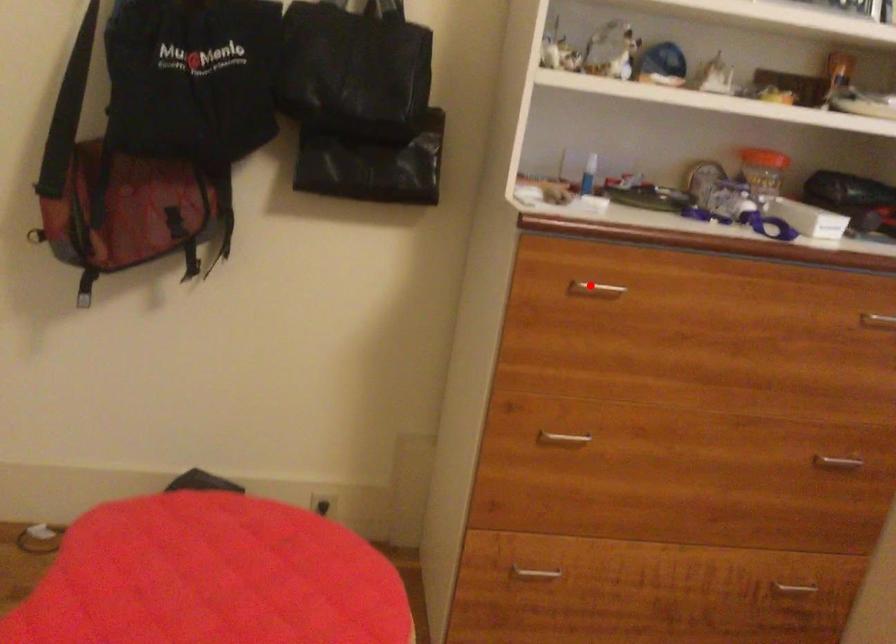
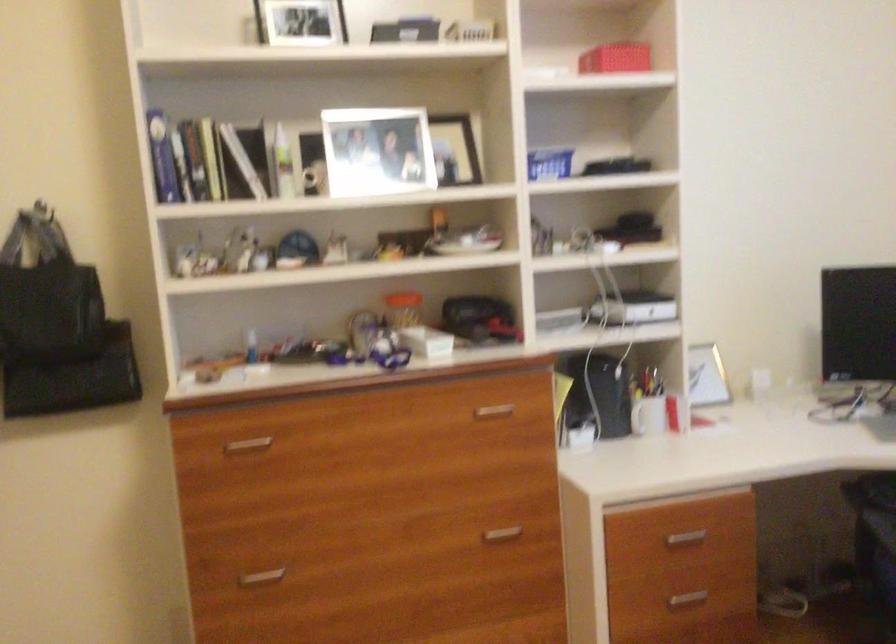
Question: I am providing you with two images of the same scene from different viewpoints. A red point is shown in image1. For the corresponding object point in image2, is it positioned nearer or farther from the camera?

Choices:
 (A) Nearer
 (B) Farther

Answer: (B)